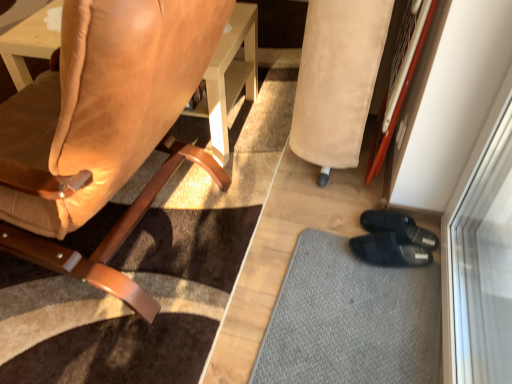
Question: Does beige suede bean bag chair at lower right appear on the left side of gray textured mat at lower right?

Choices:
 (A) yes
 (B) no

Answer: (B)

Question: From the image's perspective, is beige suede bean bag chair at lower right over gray textured mat at lower right?

Choices:
 (A) no
 (B) yes

Answer: (B)

Question: Does beige suede bean bag chair at lower right have a greater width compared to gray textured mat at lower right?

Choices:
 (A) no
 (B) yes

Answer: (A)

Question: Is beige suede bean bag chair at lower right to the right of gray textured mat at lower right from the viewer's perspective?

Choices:
 (A) yes
 (B) no

Answer: (A)

Question: Is beige suede bean bag chair at lower right facing towards gray textured mat at lower right?

Choices:
 (A) no
 (B) yes

Answer: (A)

Question: Is beige suede bean bag chair at lower right bigger or smaller than suede leather chair at left?

Choices:
 (A) small
 (B) big

Answer: (A)

Question: Based on their positions, is beige suede bean bag chair at lower right located to the left or right of suede leather chair at left?

Choices:
 (A) left
 (B) right

Answer: (B)

Question: From the image's perspective, is beige suede bean bag chair at lower right positioned above or below suede leather chair at left?

Choices:
 (A) below
 (B) above

Answer: (B)

Question: Is beige suede bean bag chair at lower right wider or thinner than suede leather chair at left?

Choices:
 (A) thin
 (B) wide

Answer: (A)

Question: In the image, is beige suede bean bag chair at lower right positioned in front of or behind gray textured mat at lower right?

Choices:
 (A) behind
 (B) front

Answer: (B)

Question: Considering the relative positions of beige suede bean bag chair at lower right and gray textured mat at lower right in the image provided, is beige suede bean bag chair at lower right to the left or to the right of gray textured mat at lower right?

Choices:
 (A) left
 (B) right

Answer: (B)

Question: Is point (370, 23) positioned closer to the camera than point (415, 354)?

Choices:
 (A) farther
 (B) closer

Answer: (A)

Question: Is beige suede bean bag chair at lower right wider or thinner than gray textured mat at lower right?

Choices:
 (A) wide
 (B) thin

Answer: (B)

Question: Is suede leather chair at left to the left or to the right of gray textured mat at lower right in the image?

Choices:
 (A) right
 (B) left

Answer: (B)

Question: Is point (117, 16) closer or farther from the camera than point (382, 329)?

Choices:
 (A) farther
 (B) closer

Answer: (B)